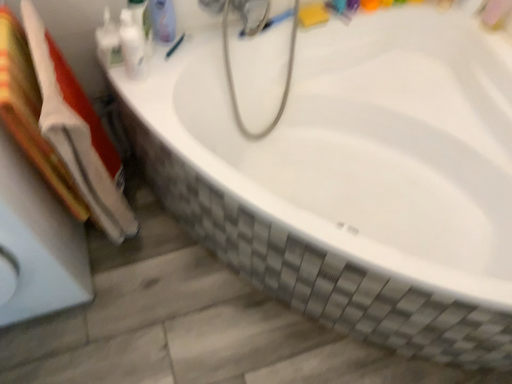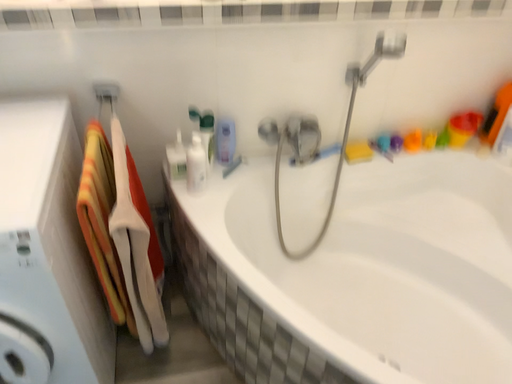
Question: How did the camera likely rotate when shooting the video?

Choices:
 (A) rotated downward
 (B) rotated upward

Answer: (B)